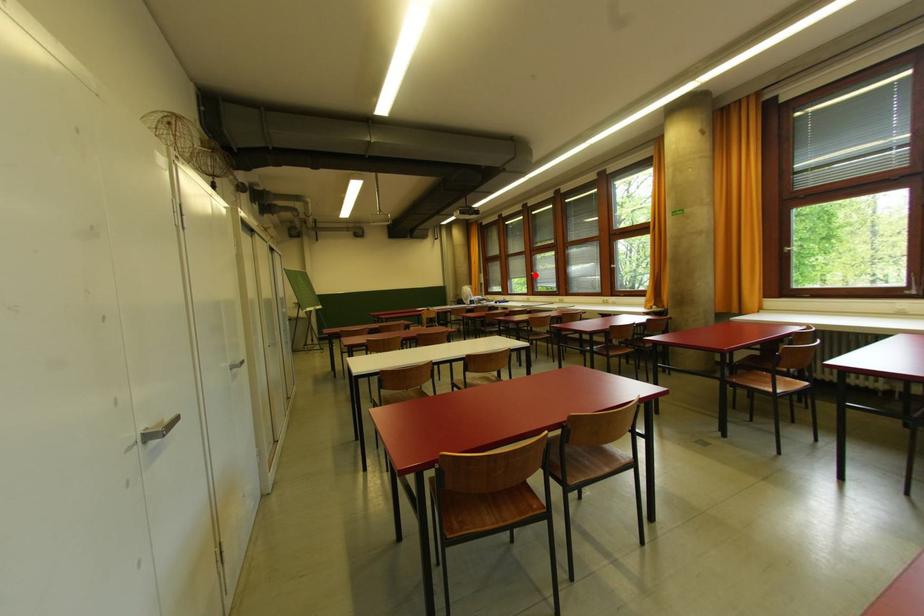
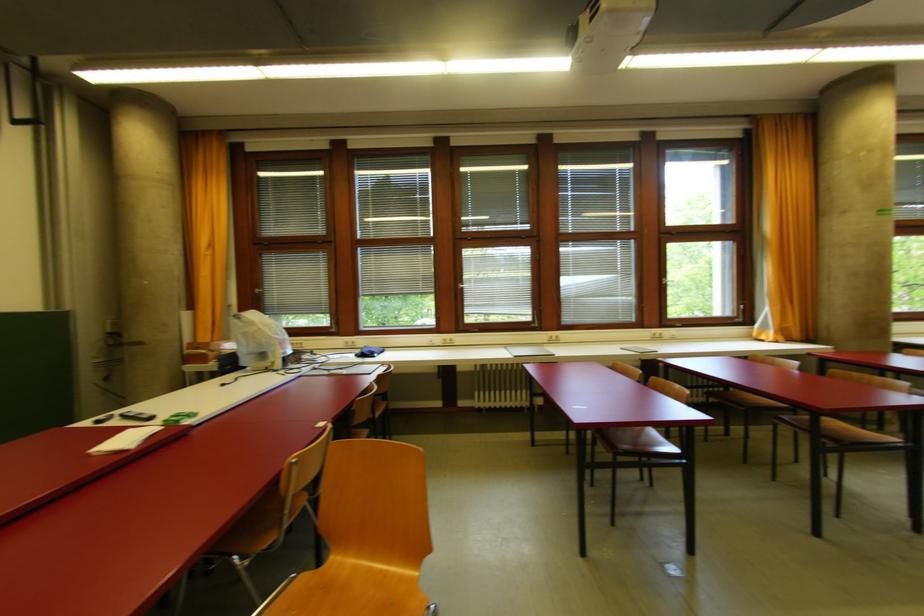
Question: A red point is marked in image1. In image2, is the corresponding 3D point closer to the camera or farther? Reply with the corresponding letter.

Choices:
 (A) The corresponding 3D point is closer.
 (B) The corresponding 3D point is farther.

Answer: (B)